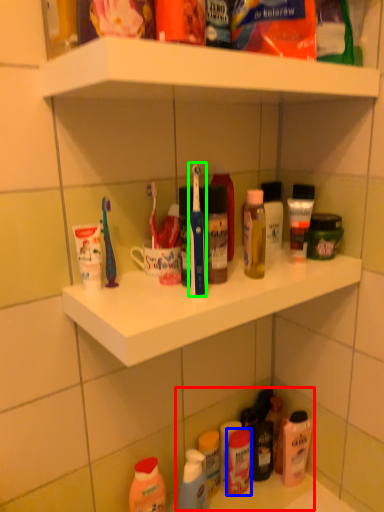
Question: Which object is positioned closest to product (highlighted by a red box)? Select from toiletry (highlighted by a blue box) and toothbrush (highlighted by a green box).

Choices:
 (A) toiletry
 (B) toothbrush

Answer: (A)